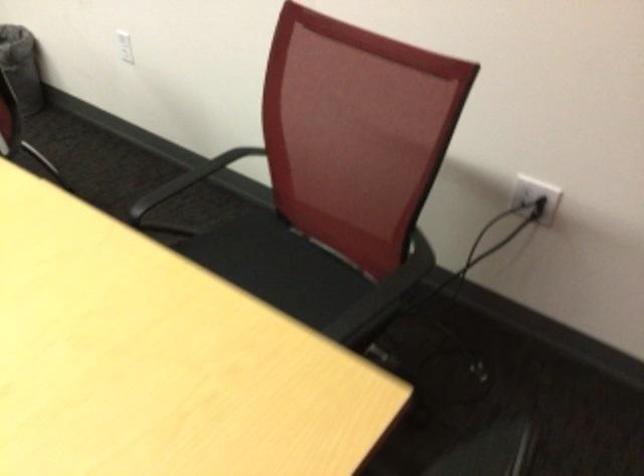
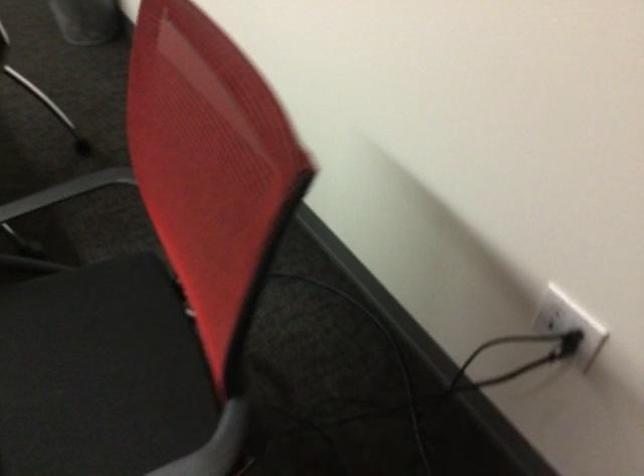
Which direction would the cameraman need to move to produce the second image?

The movement direction of the cameraman is right, forward.